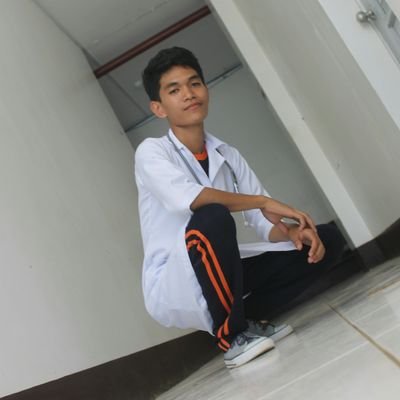
Where is `border of black baseboard to wall`? Image resolution: width=400 pixels, height=400 pixels. border of black baseboard to wall is located at coordinates (359, 248), (377, 236), (390, 227), (12, 390), (56, 376), (94, 360), (127, 351), (183, 336), (167, 342).